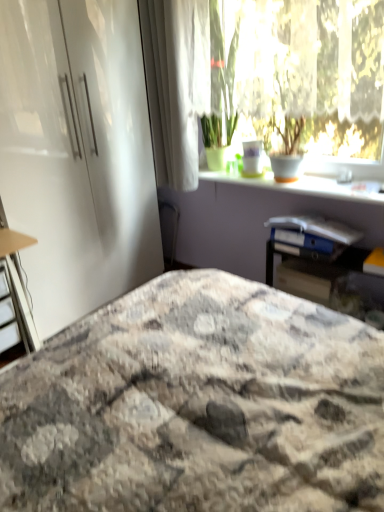
Question: From a real-world perspective, is white glossy window sill at upper center located higher than transparent glass window at upper center?

Choices:
 (A) no
 (B) yes

Answer: (A)

Question: Does white glossy window sill at upper center appear on the right side of transparent glass window at upper center?

Choices:
 (A) yes
 (B) no

Answer: (A)

Question: Is white glossy window sill at upper center beside transparent glass window at upper center?

Choices:
 (A) no
 (B) yes

Answer: (A)

Question: From the image's perspective, is white glossy window sill at upper center under transparent glass window at upper center?

Choices:
 (A) yes
 (B) no

Answer: (A)

Question: Considering the relative positions of white glossy window sill at upper center and transparent glass window at upper center in the image provided, is white glossy window sill at upper center in front of transparent glass window at upper center?

Choices:
 (A) yes
 (B) no

Answer: (B)

Question: In terms of width, does white glossy window sill at upper center look wider or thinner when compared to transparent glass window at upper center?

Choices:
 (A) wide
 (B) thin

Answer: (A)

Question: Is white glossy window sill at upper center inside the boundaries of transparent glass window at upper center, or outside?

Choices:
 (A) outside
 (B) inside

Answer: (A)

Question: In terms of height, does white glossy window sill at upper center look taller or shorter compared to transparent glass window at upper center?

Choices:
 (A) tall
 (B) short

Answer: (B)

Question: In the image, is white glossy window sill at upper center on the left side or the right side of transparent glass window at upper center?

Choices:
 (A) right
 (B) left

Answer: (A)

Question: From the image's perspective, is wooden table at right above or below white glossy cabinet at left?

Choices:
 (A) above
 (B) below

Answer: (B)

Question: Looking at the image, does wooden table at right seem bigger or smaller compared to white glossy cabinet at left?

Choices:
 (A) small
 (B) big

Answer: (A)

Question: From a real-world perspective, relative to white glossy cabinet at left, is wooden table at right vertically above or below?

Choices:
 (A) below
 (B) above

Answer: (A)

Question: Would you say wooden table at right is to the left or to the right of white glossy cabinet at left in the picture?

Choices:
 (A) left
 (B) right

Answer: (B)

Question: Is matte white desk at left taller or shorter than marble-patterned bedspread at center?

Choices:
 (A) short
 (B) tall

Answer: (B)

Question: In terms of width, does matte white desk at left look wider or thinner when compared to marble-patterned bedspread at center?

Choices:
 (A) wide
 (B) thin

Answer: (B)